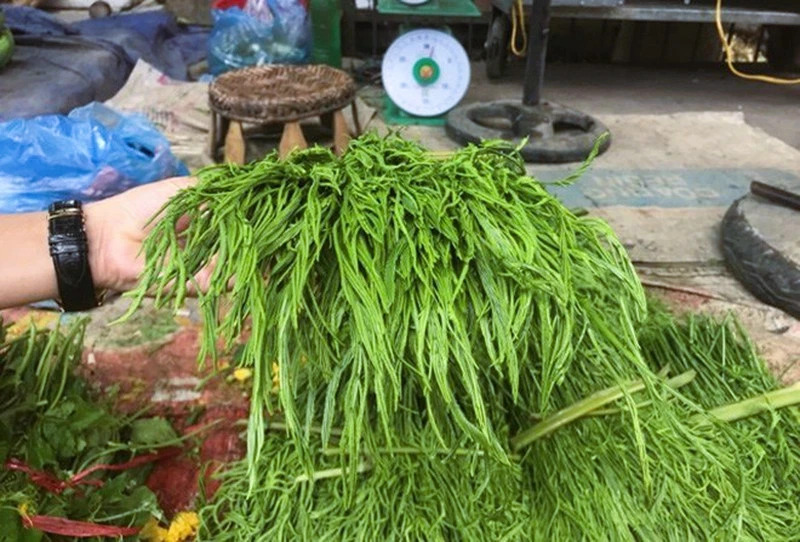
Where is `seat`? seat is located at coordinates (285, 94).